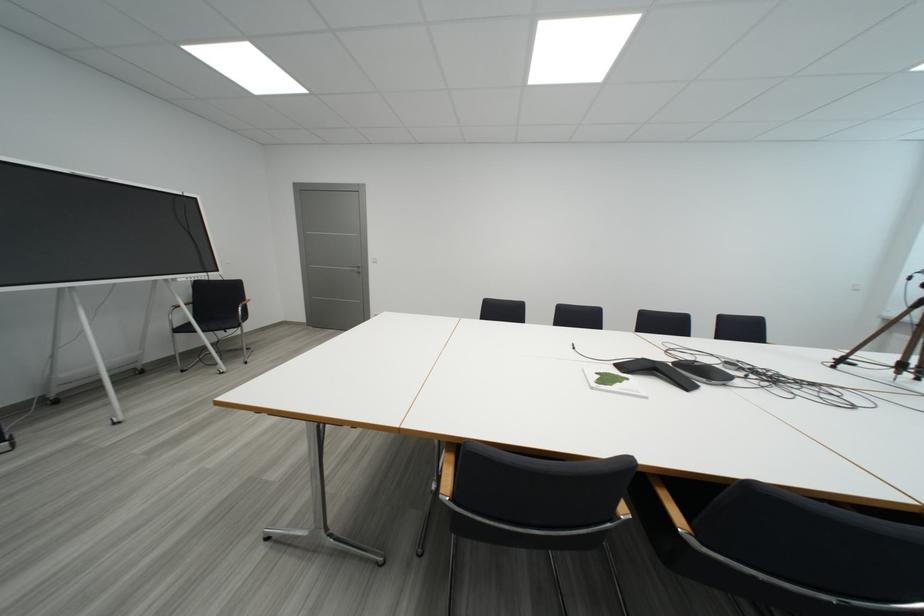
What do you see at coordinates (359, 270) in the screenshot? I see `the silver door handle` at bounding box center [359, 270].